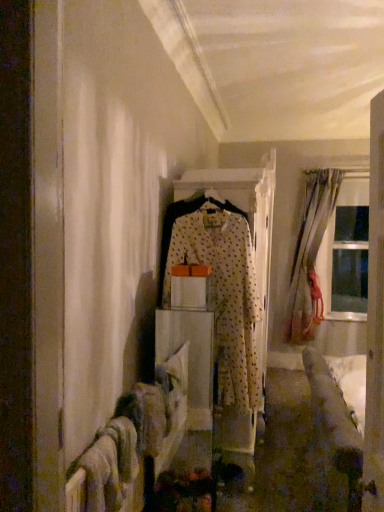
Question: From the image's perspective, relative to silky beige curtain at right, is white fabric at center above or below?

Choices:
 (A) above
 (B) below

Answer: (B)

Question: From a real-world perspective, is white fabric at center above or below silky beige curtain at right?

Choices:
 (A) below
 (B) above

Answer: (A)

Question: Based on their relative distances, which object is farther from the white dotted fabric at center?

Choices:
 (A) wooden door at right
 (B) silky beige curtain at right
 (C) transparent glass window at right
 (D) white fabric at center

Answer: (C)

Question: Based on their relative distances, which object is farther from the wooden door at right?

Choices:
 (A) silky beige curtain at right
 (B) white fabric at center
 (C) white dotted fabric at center
 (D) transparent glass window at right

Answer: (D)